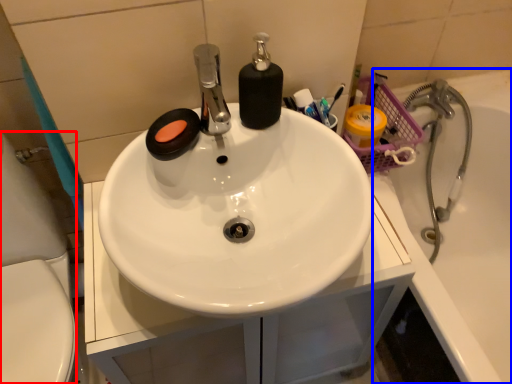
Question: Which object is closer to the camera taking this photo, porcelain (highlighted by a red box) or bath (highlighted by a blue box)?

Choices:
 (A) porcelain
 (B) bath

Answer: (A)